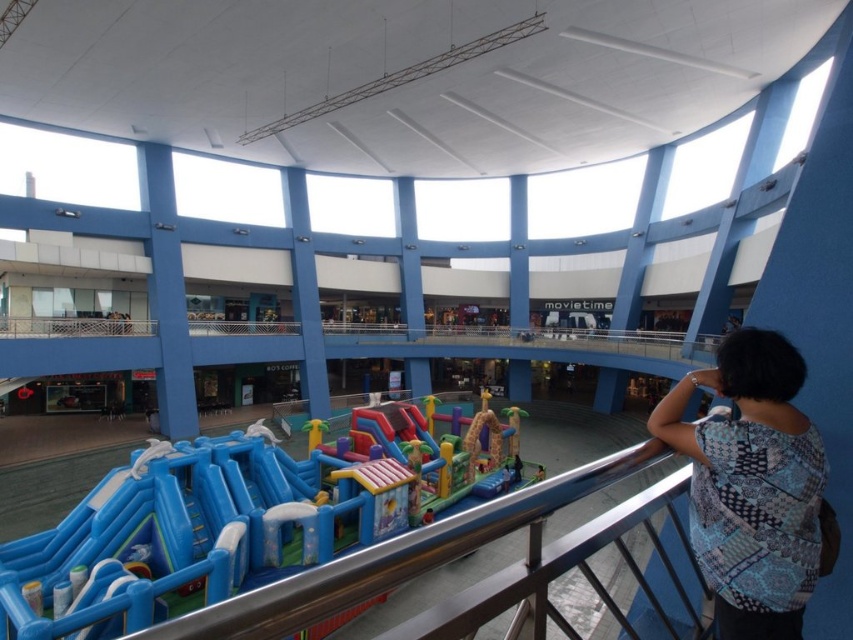
You are standing at the entrance of the inflatable play structure in the shopping mall atrium. You want to walk directly to the point marked at coordinates point [337,474]. The mall has a rule that you must stay at least 10 meters away from any structural columns. Given that the nearest column is 12 meters away from you, can you safely walk to the point without violating the rule?

The distance from you to the point [337,474] is 14.43 meters. Since the nearest column is 12 meters away from you, which is within the required 10 meters distance, you cannot safely walk to the point without violating the mall rule.

You are standing at point (809, 566) and want to walk to point (444, 438). Which direction should you move in?

You should move forward towards point (444, 438) because it is behind point (809, 566) from your current position.